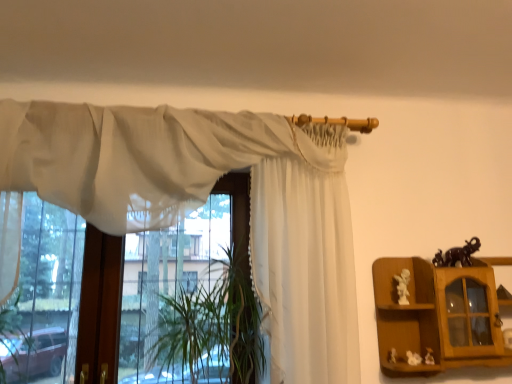
Question: Is white glossy statue at right, the 3th toy from the right, positioned behind sheer white curtain at upper center, positioned as the second curtain in right-to-left order?

Choices:
 (A) no
 (B) yes

Answer: (B)

Question: Is white glossy statue at right, placed as the 2th toy when sorted from left to right, to the left of sheer white curtain at upper center, positioned as the second curtain in right-to-left order, from the viewer's perspective?

Choices:
 (A) yes
 (B) no

Answer: (B)

Question: Considering the relative sizes of white glossy statue at right, the 3th toy from the right, and sheer white curtain at upper center, the first curtain positioned from the left, in the image provided, is white glossy statue at right, the 3th toy from the right, taller than sheer white curtain at upper center, the first curtain positioned from the left,?

Choices:
 (A) no
 (B) yes

Answer: (A)

Question: Could you tell me if white glossy statue at right, placed as the 2th toy when sorted from left to right, is facing sheer white curtain at upper center, the first curtain positioned from the left?

Choices:
 (A) yes
 (B) no

Answer: (B)

Question: From a real-world perspective, is white glossy statue at right, the third toy positioned from the bottom, physically below sheer white curtain at upper center, the first curtain positioned from the left?

Choices:
 (A) no
 (B) yes

Answer: (B)

Question: Based on their sizes in the image, would you say black glossy elephant at upper right, placed as the fourth toy when sorted from bottom to top, is bigger or smaller than sheer white curtain at upper center, positioned as the second curtain in right-to-left order?

Choices:
 (A) small
 (B) big

Answer: (A)

Question: Is black glossy elephant at upper right, placed as the fourth toy when sorted from bottom to top, wider or thinner than sheer white curtain at upper center, positioned as the second curtain in right-to-left order?

Choices:
 (A) thin
 (B) wide

Answer: (A)

Question: In terms of height, does black glossy elephant at upper right, positioned as the first toy in top-to-bottom order, look taller or shorter compared to sheer white curtain at upper center, positioned as the second curtain in right-to-left order?

Choices:
 (A) tall
 (B) short

Answer: (B)

Question: Is black glossy elephant at upper right, the first toy when ordered from right to left, in front of or behind sheer white curtain at upper center, the first curtain positioned from the left, in the image?

Choices:
 (A) front
 (B) behind

Answer: (B)

Question: Considering the positions of point (390, 350) and point (414, 362), is point (390, 350) closer or farther from the camera than point (414, 362)?

Choices:
 (A) closer
 (B) farther

Answer: (B)

Question: Considering the positions of white porcelain statue at lower right, positioned as the fourth toy in right-to-left order, and white matte figurine at lower right, which is counted as the 3th toy, starting from the top, in the image, is white porcelain statue at lower right, positioned as the fourth toy in right-to-left order, wider or thinner than white matte figurine at lower right, which is counted as the 3th toy, starting from the top,?

Choices:
 (A) thin
 (B) wide

Answer: (A)

Question: From the image's perspective, is white porcelain statue at lower right, which is the 4th toy from top to bottom, located above or below white matte figurine at lower right, the second toy positioned from the bottom?

Choices:
 (A) below
 (B) above

Answer: (A)

Question: In the image, is white porcelain statue at lower right, the 1th toy ordered from the bottom, on the left side or the right side of white matte figurine at lower right, which is the 3th toy from left to right?

Choices:
 (A) left
 (B) right

Answer: (A)

Question: From a real-world perspective, relative to wooden cabinet at right, is white glossy statue at right, the third toy positioned from the bottom, vertically above or below?

Choices:
 (A) below
 (B) above

Answer: (B)

Question: Considering the positions of white glossy statue at right, the third toy positioned from the bottom, and wooden cabinet at right in the image, is white glossy statue at right, the third toy positioned from the bottom, wider or thinner than wooden cabinet at right?

Choices:
 (A) thin
 (B) wide

Answer: (A)